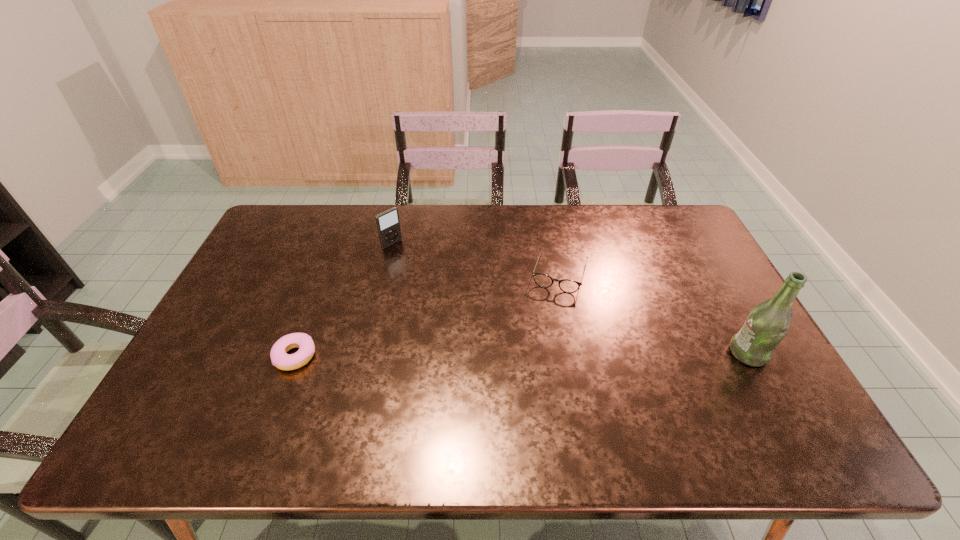
Identify the location of doughnut. (279, 357).

I want to click on the leftmost object, so click(x=279, y=357).

Where is `the tallest object`? The width and height of the screenshot is (960, 540). the tallest object is located at coordinates (767, 324).

Identify the location of beer bottle. (767, 324).

The height and width of the screenshot is (540, 960). In order to click on the farthest object in this screenshot , I will do `click(388, 224)`.

Identify the location of iPod. This screenshot has height=540, width=960. click(388, 224).

Where is `the third tallest object`? the third tallest object is located at coordinates (545, 281).

The width and height of the screenshot is (960, 540). Find the location of `the third object from left to right`. the third object from left to right is located at coordinates (545, 281).

This screenshot has height=540, width=960. In order to click on free space located 0.180m on the right of the doughnut in this screenshot , I will do pyautogui.click(x=385, y=356).

This screenshot has width=960, height=540. I want to click on vacant space located 0.390m on the front-facing side of the third shortest object, so click(x=475, y=310).